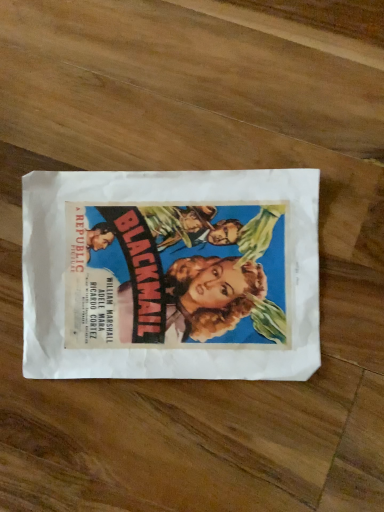
This screenshot has width=384, height=512. In order to click on vacant region above vintage paper poster at center (from a real-world perspective) in this screenshot , I will do `click(172, 268)`.